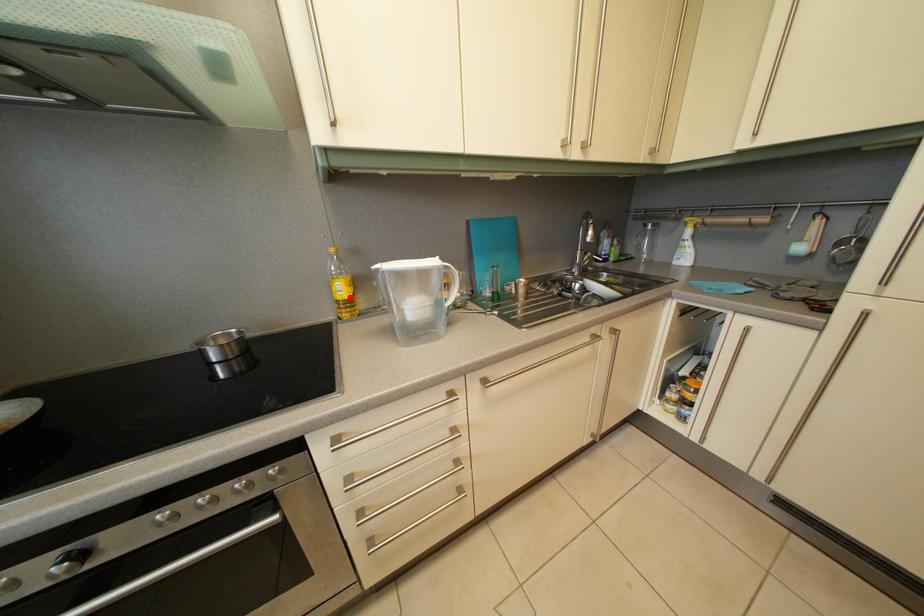
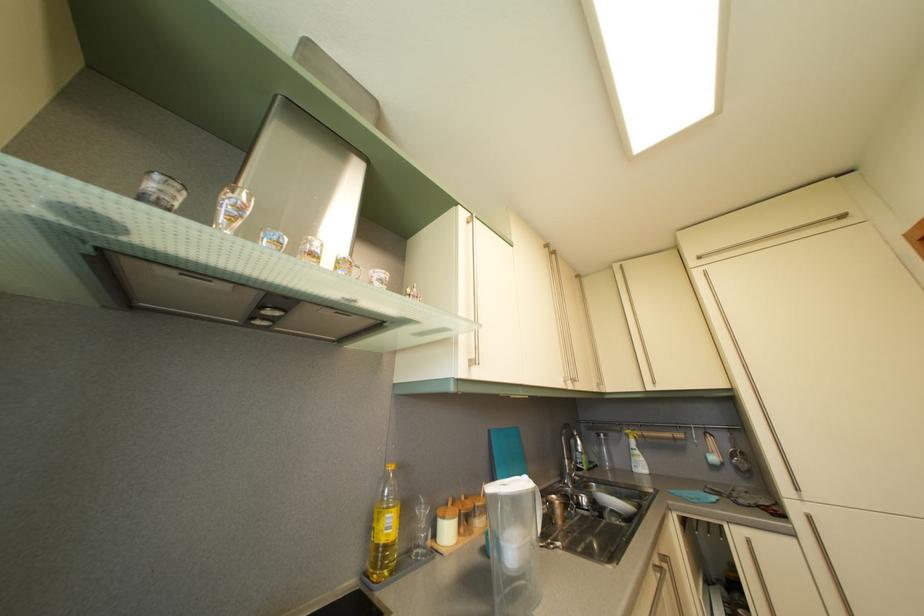
In the second image, find the point that corresponds to the highlighted location in the first image.

(396, 533)